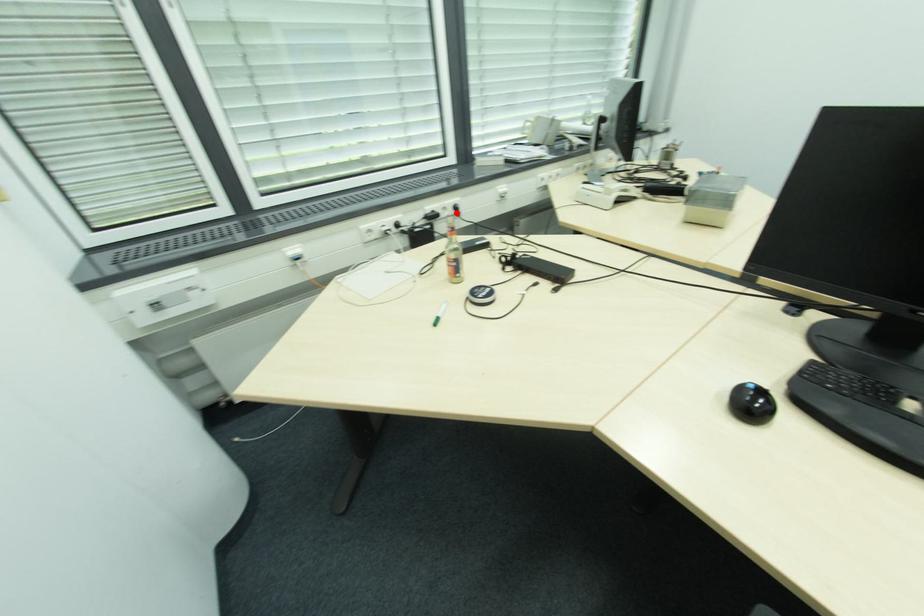
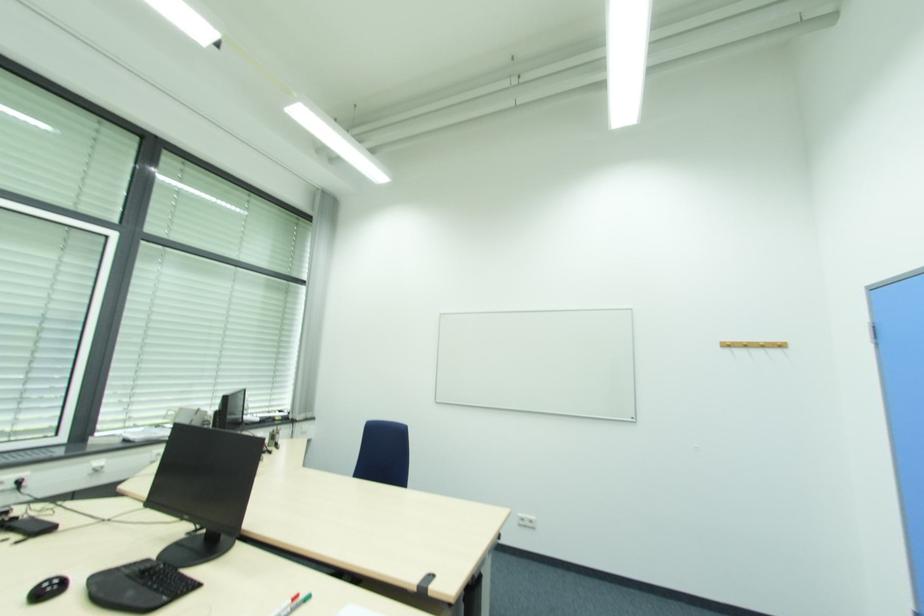
The point at the highlighted location is marked in the first image. Where is the corresponding point in the second image?

(17, 487)